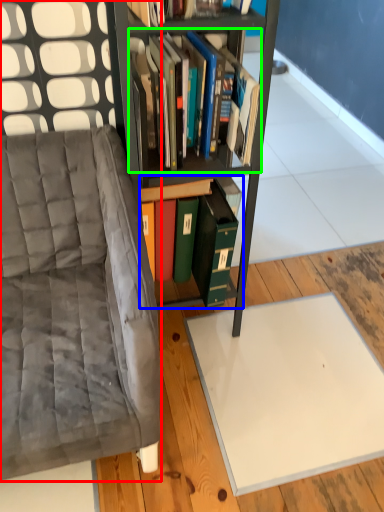
Question: Based on their relative distances, which object is farther from chair (highlighted by a red box)? Choose from book (highlighted by a blue box) and book (highlighted by a green box).

Choices:
 (A) book
 (B) book

Answer: (B)